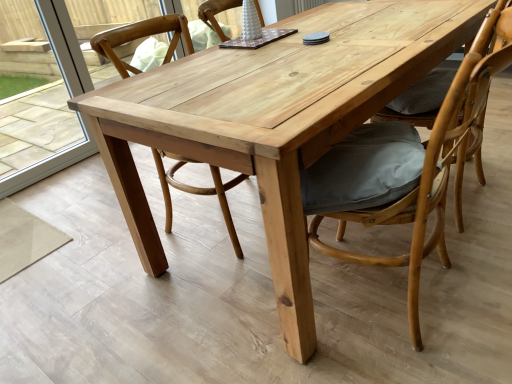
Locate an element on the screen. blank area beneath transparent glass door at left (from a real-world perspective) is located at coordinates (52, 164).